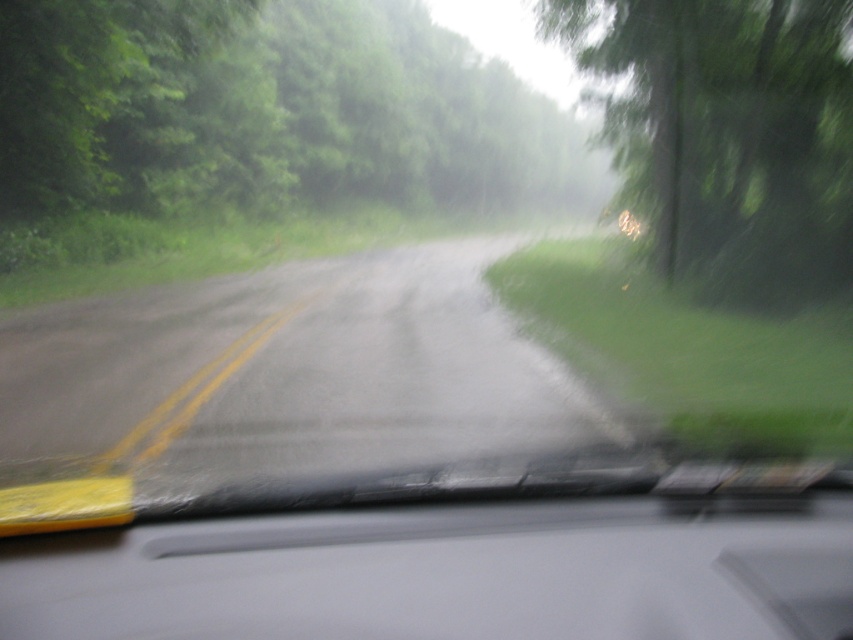
Question: In this image, where is green leafy tree at upper left located relative to green matte tree at right?

Choices:
 (A) above
 (B) below

Answer: (A)

Question: Can you confirm if green leafy tree at upper left is positioned to the right of green matte tree at right?

Choices:
 (A) no
 (B) yes

Answer: (A)

Question: Does green leafy tree at upper left appear on the left side of green matte tree at right?

Choices:
 (A) no
 (B) yes

Answer: (B)